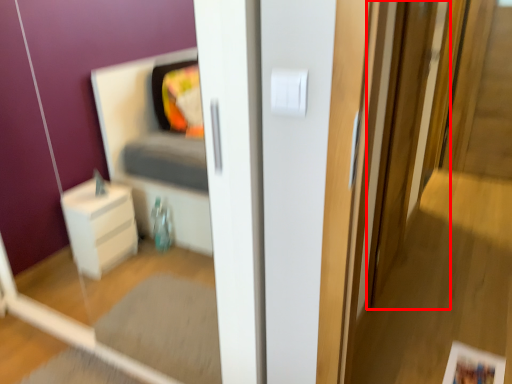
Question: From the image's perspective, what is the correct spatial relationship of screen door (annotated by the red box) in relation to light switch?

Choices:
 (A) above
 (B) below

Answer: (B)